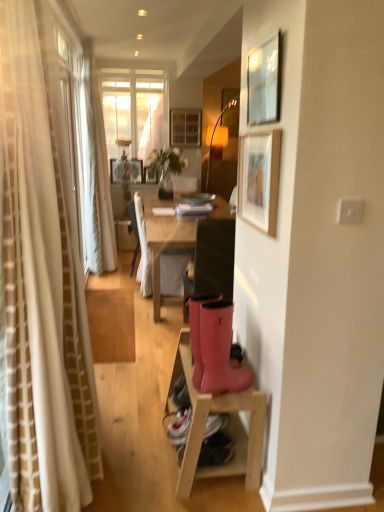
The height and width of the screenshot is (512, 384). What do you see at coordinates (150, 175) in the screenshot?
I see `wooden picture frame at center, the fourth picture frame positioned from the front` at bounding box center [150, 175].

Identify the location of wooden picture frame at center, which is the 3th picture frame from right to left. The height and width of the screenshot is (512, 384). (150, 175).

Identify the location of translucent glass vase at center. (167, 161).

What do you see at coordinates (219, 351) in the screenshot?
I see `rubber boots at lower center` at bounding box center [219, 351].

Locate an element on the screen. The image size is (384, 512). rubber boots at lower center is located at coordinates (219, 351).

Identify the location of matte wooden cabinet at upper center. (185, 127).

Can you confirm if translucent glass vase at center is positioned to the right of matte black chair at center, the first chair positioned from the right?

No.

Is matte black chair at center, which is the 1th chair from front to back, a part of translucent glass vase at center?

No, matte black chair at center, which is the 1th chair from front to back, is not a part of translucent glass vase at center.

This screenshot has width=384, height=512. In the image, there is a matte black chair at center, the second chair from the back. What are the coordinates of `flower above it (from the image's perspective)` in the screenshot? It's located at (167, 161).

From the image's perspective, does wooden picture frame at center, placed as the first picture frame when sorted from left to right, appear higher than matte wooden cabinet at upper center?

No, from the image's perspective, wooden picture frame at center, placed as the first picture frame when sorted from left to right, is not above matte wooden cabinet at upper center.

Does wooden picture frame at center, placed as the fourth picture frame when sorted from bottom to top, have a larger size compared to matte wooden cabinet at upper center?

Indeed, wooden picture frame at center, placed as the fourth picture frame when sorted from bottom to top, has a larger size compared to matte wooden cabinet at upper center.

Does wooden picture frame at center, the third picture frame positioned from the front, have a greater height compared to matte wooden cabinet at upper center?

No.

Does point (128, 166) come behind point (171, 122)?

No.

What's the angular difference between wooden picture frame at center, placed as the fourth picture frame when sorted from bottom to top, and metallic silver picture frame at upper right, marked as the 2th picture frame in a bottom-to-top arrangement,'s facing directions?

The angle between the facing direction of wooden picture frame at center, placed as the fourth picture frame when sorted from bottom to top, and the facing direction of metallic silver picture frame at upper right, marked as the 2th picture frame in a bottom-to-top arrangement, is 89.9 degrees.

Considering the sizes of objects wooden picture frame at center, marked as the 2th picture frame in a back-to-front arrangement, and metallic silver picture frame at upper right, the 4th picture frame in the back-to-front sequence, in the image provided, who is shorter, wooden picture frame at center, marked as the 2th picture frame in a back-to-front arrangement, or metallic silver picture frame at upper right, the 4th picture frame in the back-to-front sequence,?

metallic silver picture frame at upper right, the 4th picture frame in the back-to-front sequence.

From a real-world perspective, which object rests below the other?

wooden picture frame at center, placed as the first picture frame when sorted from left to right, is physically lower.

Considering the sizes of objects wooden stool at lower right and translucent glass vase at center in the image provided, who is bigger, wooden stool at lower right or translucent glass vase at center?

wooden stool at lower right is bigger.

The height and width of the screenshot is (512, 384). I want to click on flower above the wooden stool at lower right (from a real-world perspective), so click(x=167, y=161).

Which is closer to the camera, (184,450) or (161,156)?

Point (184,450) is closer to the camera than point (161,156).

Is wooden picture frame at upper right, which ranks as the fourth picture frame in top-to-bottom order, placed right next to translucent glass vase at center?

No, wooden picture frame at upper right, which ranks as the fourth picture frame in top-to-bottom order, is not with translucent glass vase at center.

Is wooden picture frame at upper right, which ranks as the fourth picture frame in top-to-bottom order, looking in the opposite direction of translucent glass vase at center?

No, wooden picture frame at upper right, which ranks as the fourth picture frame in top-to-bottom order,'s orientation is not away from translucent glass vase at center.

Which is more to the left, wooden picture frame at upper right, which ranks as the fourth picture frame in top-to-bottom order, or translucent glass vase at center?

translucent glass vase at center.

Considering the sizes of matte black chair at center, the first chair positioned from the right, and white fabric chair at center, which appears as the 2th chair when viewed from the right, in the image, is matte black chair at center, the first chair positioned from the right, bigger or smaller than white fabric chair at center, which appears as the 2th chair when viewed from the right,?

In the image, matte black chair at center, the first chair positioned from the right, appears to be smaller than white fabric chair at center, which appears as the 2th chair when viewed from the right.

Between matte black chair at center, the second chair from the back, and white fabric chair at center, which appears as the second chair when viewed from the front, which one is positioned in front?

Positioned in front is matte black chair at center, the second chair from the back.

Is translucent glass vase at center positioned beyond the bounds of wooden picture frame at center, positioned as the second picture frame in top-to-bottom order?

Absolutely, translucent glass vase at center is external to wooden picture frame at center, positioned as the second picture frame in top-to-bottom order.

In the scene shown: Is translucent glass vase at center behind wooden picture frame at center, which is the 3th picture frame from right to left?

No, the depth of translucent glass vase at center is less than that of wooden picture frame at center, which is the 3th picture frame from right to left.

Can you confirm if translucent glass vase at center is smaller than wooden picture frame at center, the 3th picture frame from the bottom?

Incorrect, translucent glass vase at center is not smaller in size than wooden picture frame at center, the 3th picture frame from the bottom.

Are translucent glass vase at center and wooden picture frame at center, the 1th picture frame viewed from the back, far apart?

translucent glass vase at center is near wooden picture frame at center, the 1th picture frame viewed from the back, not far away.

Which chair is the 2nd one when counting from the front of the translucent glass vase at center? Please provide its 2D coordinates.

[(212, 261)]

This screenshot has width=384, height=512. Identify the location of cabinetry above the wooden picture frame at center, placed as the fourth picture frame when sorted from bottom to top (from a real-world perspective). point(185,127).

Considering their positions, is rubber boots at lower center positioned further to translucent glass vase at center than matte black chair at center, the second chair from the back?

rubber boots at lower center is positioned further to the anchor translucent glass vase at center.

Which object lies further to the anchor point metallic silver picture frame at upper right, placed as the 1th picture frame when sorted from front to back, wooden stool at lower right or wooden picture frame at center, the fourth picture frame positioned from the front?

wooden picture frame at center, the fourth picture frame positioned from the front, is further to metallic silver picture frame at upper right, placed as the 1th picture frame when sorted from front to back.

From the image, which object appears to be farther from wooden picture frame at upper right, which is the second picture frame in right-to-left order, matte black chair at center, which is the 1th chair from front to back, or wooden stool at lower right?

The object further to wooden picture frame at upper right, which is the second picture frame in right-to-left order, is wooden stool at lower right.

From the image, which object appears to be nearer to white fabric chair at center, which appears as the 2th chair when viewed from the right, matte black chair at center, the second chair from the back, or rubber boots at lower center?

Among the two, matte black chair at center, the second chair from the back, is located nearer to white fabric chair at center, which appears as the 2th chair when viewed from the right.

Based on their spatial positions, is metallic silver picture frame at upper right, the 4th picture frame in the back-to-front sequence, or wooden picture frame at center, the third picture frame positioned from the front, closer to translucent glass vase at center?

Among the two, wooden picture frame at center, the third picture frame positioned from the front, is located nearer to translucent glass vase at center.

Which object lies further to the anchor point matte wooden cabinet at upper center, metallic silver picture frame at upper right, the 4th picture frame in the back-to-front sequence, or wooden picture frame at center, placed as the fourth picture frame when sorted from bottom to top?

metallic silver picture frame at upper right, the 4th picture frame in the back-to-front sequence.

Estimate the real-world distances between objects in this image. Which object is closer to translucent glass vase at center, wooden picture frame at center, the fourth picture frame positioned from the front, or wooden stool at lower right?

Among the two, wooden picture frame at center, the fourth picture frame positioned from the front, is located nearer to translucent glass vase at center.

Considering their positions, is translucent glass vase at center positioned closer to wooden stool at lower right than rubber boots at lower center?

rubber boots at lower center is closer to wooden stool at lower right.

I want to click on table positioned between rubber boots at lower center and translucent glass vase at center from near to far, so click(228, 426).

Where is `footwear between wooden picture frame at upper right, which is the second picture frame in right-to-left order, and white fabric chair at center, which appears as the 2th chair when viewed from the right, from front to back`? footwear between wooden picture frame at upper right, which is the second picture frame in right-to-left order, and white fabric chair at center, which appears as the 2th chair when viewed from the right, from front to back is located at coordinates (219, 351).

At what (x,y) coordinates should I click in order to perform the action: click on flower located between rubber boots at lower center and wooden picture frame at center, placed as the fourth picture frame when sorted from bottom to top, in the depth direction. Please return your answer as a coordinate pair (x, y). The height and width of the screenshot is (512, 384). Looking at the image, I should click on (167, 161).

In order to click on footwear located between metallic silver picture frame at upper right, the 4th picture frame from the left, and matte wooden cabinet at upper center in the depth direction in this screenshot , I will do `click(219, 351)`.